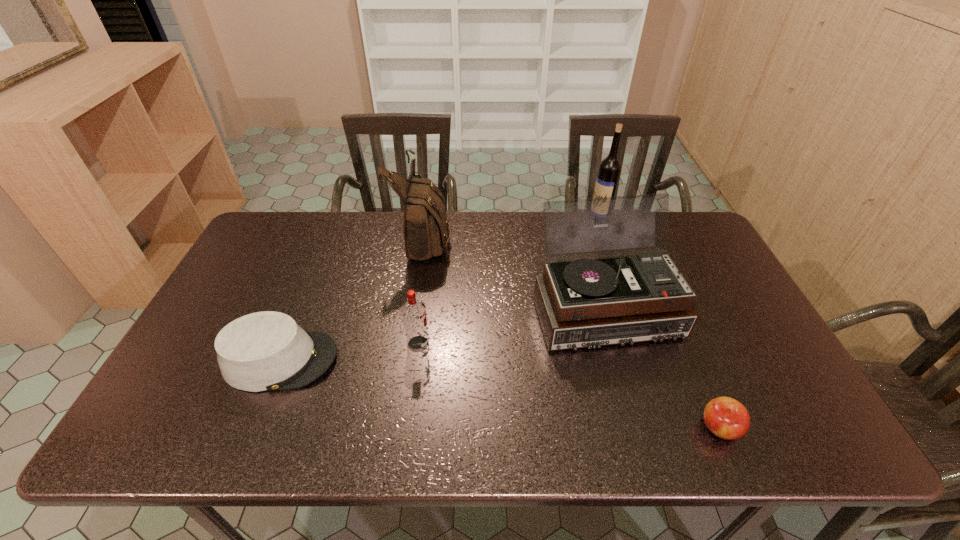
Find the location of a particular element. This screenshot has height=540, width=960. vacant space at the far edge of the desktop is located at coordinates (316, 248).

Locate an element on the screen. Image resolution: width=960 pixels, height=540 pixels. vacant space at the left edge of the desktop is located at coordinates (252, 292).

The height and width of the screenshot is (540, 960). What are the coordinates of `free spot at the right edge of the desktop` in the screenshot? It's located at (759, 369).

Identify the location of vacant space at the near left corner of the desktop. (206, 423).

What are the coordinates of `free location at the far right corner of the desktop` in the screenshot? It's located at (679, 254).

Locate an element on the screen. empty location between the fifth tallest object and the wine bottle is located at coordinates (440, 291).

Image resolution: width=960 pixels, height=540 pixels. I want to click on vacant area between the vodka and the leftmost object, so click(349, 352).

Find the location of a particular element. The height and width of the screenshot is (540, 960). empty location between the fourth tallest object and the wine bottle is located at coordinates (509, 282).

Where is `unoccupied position between the record player and the third shortest object`? This screenshot has height=540, width=960. unoccupied position between the record player and the third shortest object is located at coordinates point(511,326).

What are the coordinates of `free space between the fifth tallest object and the wine bottle` in the screenshot? It's located at (440, 291).